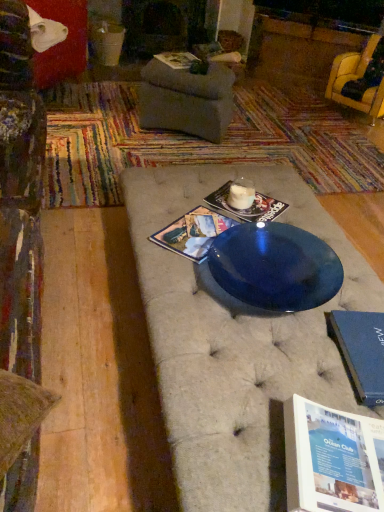
Where is `vacant area that is situated to the right of white glossy plate at center`? This screenshot has width=384, height=512. vacant area that is situated to the right of white glossy plate at center is located at coordinates 274,205.